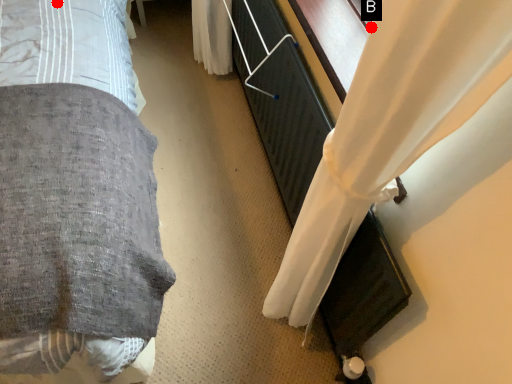
Question: Two points are circled on the image, labeled by A and B beside each circle. Which point is further to the camera?

Choices:
 (A) A is further
 (B) B is further

Answer: (A)